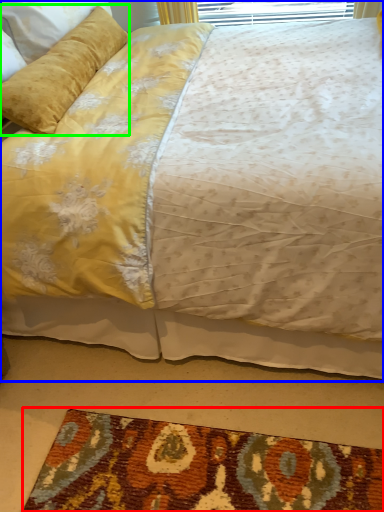
Question: Which object is the farthest from mat (highlighted by a red box)? Choose among these: bed (highlighted by a blue box) or pillow (highlighted by a green box).

Choices:
 (A) bed
 (B) pillow

Answer: (B)